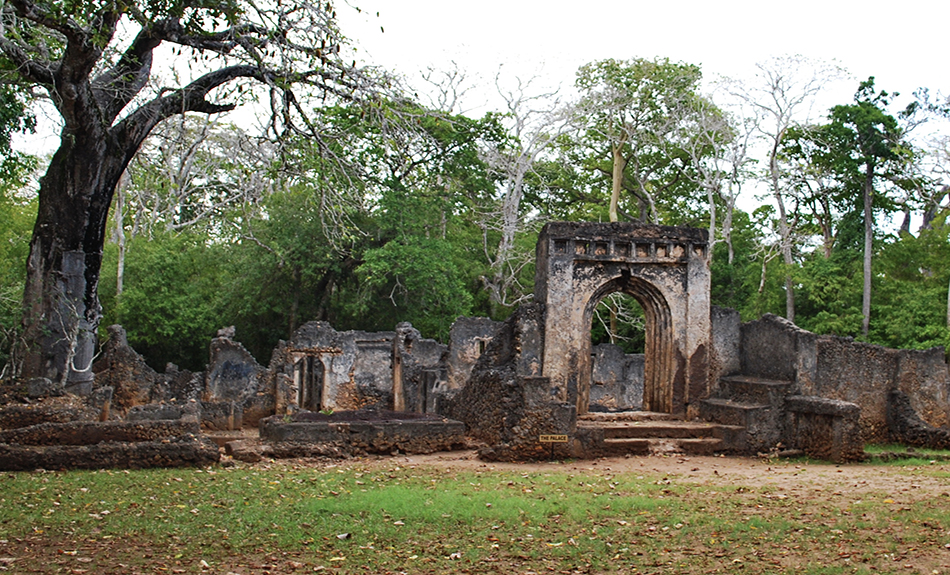
Where is `entryway`? The image size is (950, 575). entryway is located at coordinates (618, 302), (310, 380).